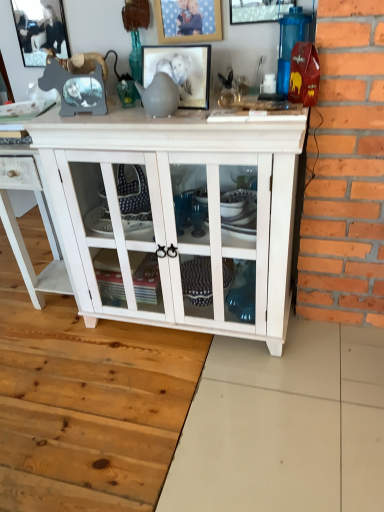
Question: Is matte glass picture frame at center, which ranks as the 2th picture frame in left-to-right order, situated inside white wood cupboard at center or outside?

Choices:
 (A) inside
 (B) outside

Answer: (B)

Question: From the image's perspective, is matte glass picture frame at center, which is the third picture frame from right to left, positioned above or below white wood cupboard at center?

Choices:
 (A) above
 (B) below

Answer: (A)

Question: Based on their relative distances, which object is nearer to the white wood cabinet at center?

Choices:
 (A) white wood cupboard at center
 (B) wooden picture frame at upper center, placed as the 3th picture frame when sorted from left to right
 (C) matte glass picture frame at center, which is the third picture frame from right to left
 (D) metallic silver picture frame at upper left, arranged as the first picture frame when viewed from the left
 (E) metallic silver picture frame at upper center, which is the 4th picture frame from left to right

Answer: (A)

Question: Estimate the real-world distances between objects in this image. Which object is closer to the metallic silver picture frame at upper left, the fourth picture frame viewed from the right?

Choices:
 (A) matte glass picture frame at center, which is the third picture frame from right to left
 (B) wooden picture frame at upper center, the second picture frame from the right
 (C) metallic silver picture frame at upper center, the first picture frame in the right-to-left sequence
 (D) white wood cupboard at center
 (E) white wood cabinet at center

Answer: (A)